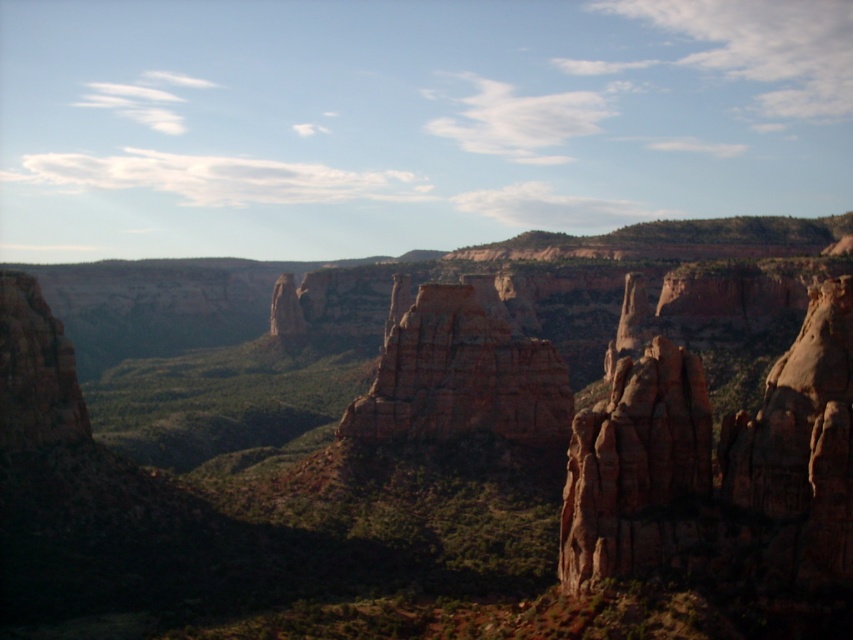
Question: Among these points, which one is farthest from the camera?

Choices:
 (A) (491, 563)
 (B) (440, 417)

Answer: (B)

Question: Is rustic sandstone rock formation at right bigger than rustic sandstone rock formation at center?

Choices:
 (A) no
 (B) yes

Answer: (B)

Question: Is rustic sandstone rock formation at right bigger than rustic sandstone rock formation at center?

Choices:
 (A) yes
 (B) no

Answer: (A)

Question: Which of these objects is positioned farthest from the rustic sandstone rock formation at center?

Choices:
 (A) rustic sandstone rock formation at right
 (B) rustic rock formation at center

Answer: (B)

Question: Which point appears farthest from the camera in this image?

Choices:
 (A) (523, 490)
 (B) (805, 365)

Answer: (A)

Question: Is rustic rock formation at center to the right of rustic sandstone rock formation at center from the viewer's perspective?

Choices:
 (A) no
 (B) yes

Answer: (A)